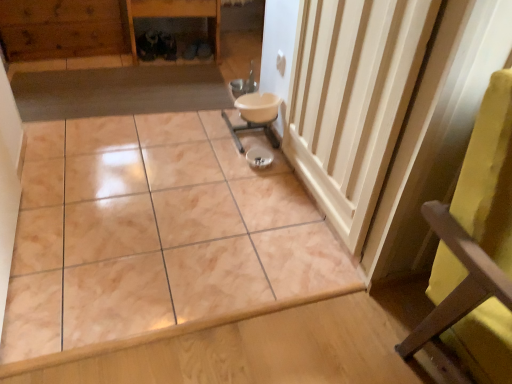
This screenshot has height=384, width=512. Identify the location of vacant space that is in between white wood radiator at center right and white glossy sink at center. (289, 201).